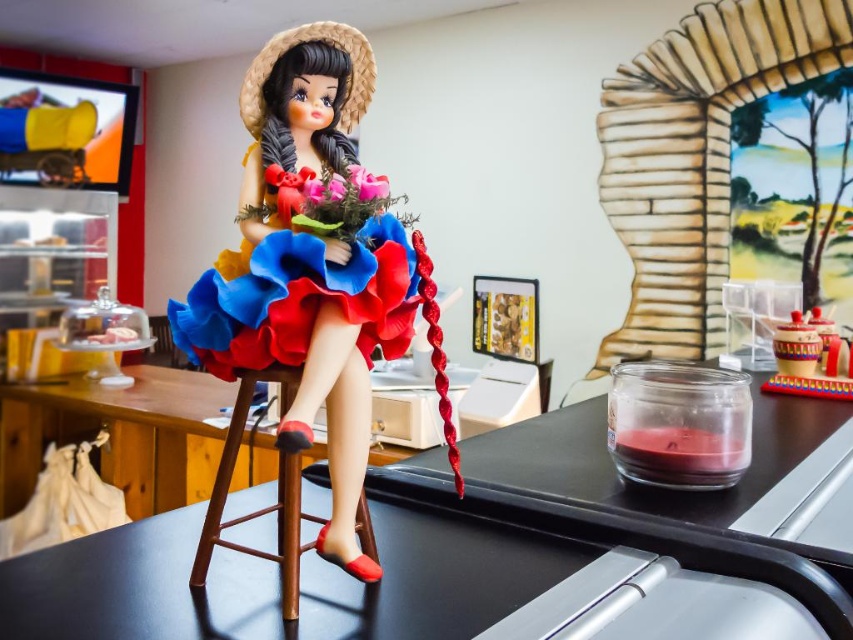
Question: Can you confirm if matte plastic doll at center is bigger than woven straw hat at upper center?

Choices:
 (A) yes
 (B) no

Answer: (A)

Question: Which point is farther to the camera?

Choices:
 (A) shiny black table at center
 (B) matte plastic dress at center
 (C) matte plastic doll at center
 (D) matte pink fabric flower at center

Answer: (D)

Question: Estimate the real-world distances between objects in this image. Which object is closer to the matte plastic flower at center?

Choices:
 (A) woven straw hat at upper center
 (B) matte pink fabric flower at center
 (C) matte plastic cake stand at left
 (D) matte plastic bouquet at center

Answer: (D)

Question: Which point appears farthest from the camera in this image?

Choices:
 (A) (271, 173)
 (B) (379, 189)
 (C) (404, 321)
 (D) (338, 397)

Answer: (D)

Question: From the image, what is the correct spatial relationship of woven straw hat at upper center in relation to matte plastic cake stand at left?

Choices:
 (A) below
 (B) above

Answer: (B)

Question: Is matte plastic dress at center above matte ceramic bowl at upper right?

Choices:
 (A) yes
 (B) no

Answer: (A)